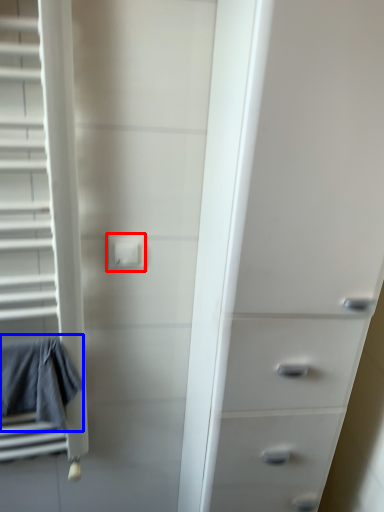
Question: Among these objects, which one is nearest to the camera, electric outlet (highlighted by a red box) or bath towel (highlighted by a blue box)?

Choices:
 (A) electric outlet
 (B) bath towel

Answer: (B)